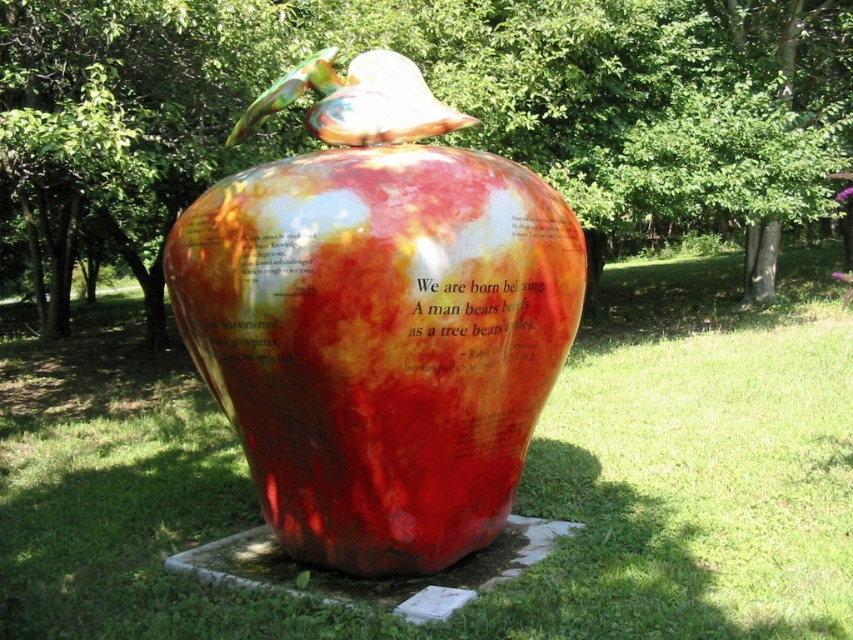
Question: Is glossy ceramic apple at center bigger than shiny ceramic vase at center?

Choices:
 (A) yes
 (B) no

Answer: (A)

Question: Can you confirm if glossy ceramic apple at center is positioned to the left of shiny ceramic vase at center?

Choices:
 (A) no
 (B) yes

Answer: (B)

Question: Which object is positioned farthest from the glossy ceramic apple at center?

Choices:
 (A) green grass at center
 (B) shiny ceramic vase at center

Answer: (B)

Question: Which object appears closest to the camera in this image?

Choices:
 (A) shiny ceramic vase at center
 (B) glossy ceramic apple at center

Answer: (A)

Question: Based on their relative distances, which object is nearer to the green grass at center?

Choices:
 (A) glossy ceramic apple at center
 (B) shiny ceramic vase at center

Answer: (B)

Question: Is glossy ceramic apple at center wider than shiny ceramic vase at center?

Choices:
 (A) yes
 (B) no

Answer: (A)